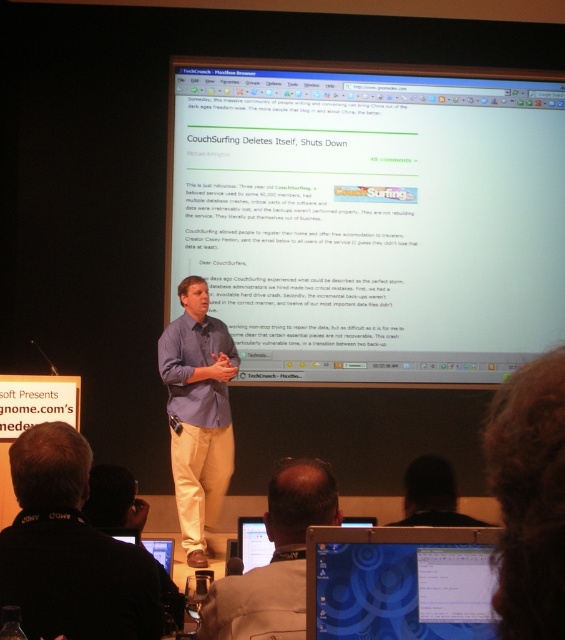
Question: Which is farther from the white glossy phone at lower center?

Choices:
 (A) black matte shirt at lower center
 (B) blue cotton shirt at center
 (C) blue glossy laptop at lower center

Answer: (B)

Question: Does dark curly hair at upper right appear under white glossy phone at lower center?

Choices:
 (A) no
 (B) yes

Answer: (B)

Question: Is white glossy projection screen at upper center to the left of blue glossy laptop at lower center from the viewer's perspective?

Choices:
 (A) yes
 (B) no

Answer: (B)

Question: Which point is closer to the camera?

Choices:
 (A) (206, 417)
 (B) (505, 264)
 (C) (523, 612)

Answer: (C)

Question: Which of the following is the farthest from the observer?

Choices:
 (A) white glossy phone at lower center
 (B) blue glossy laptop at lower center
 (C) blue cotton shirt at center
 (D) dark curly hair at upper right

Answer: (D)

Question: Is black matte shirt at lower center closer to camera compared to white glossy phone at lower center?

Choices:
 (A) yes
 (B) no

Answer: (A)